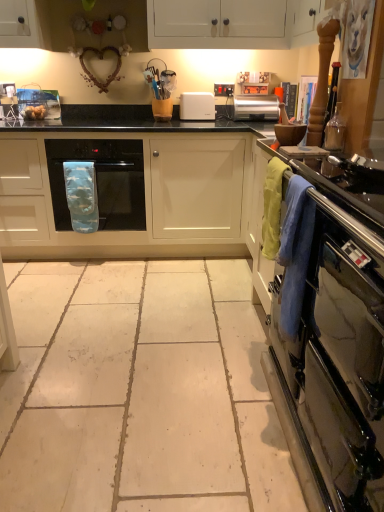
Question: Is blue fabric oven mitt at center in front of or behind black matte countertop at center in the image?

Choices:
 (A) behind
 (B) front

Answer: (A)

Question: Considering the positions of blue fabric oven mitt at center and black matte countertop at center in the image, is blue fabric oven mitt at center taller or shorter than black matte countertop at center?

Choices:
 (A) tall
 (B) short

Answer: (B)

Question: Which of these objects is positioned farthest from the stainless steel oven at right?

Choices:
 (A) white plastic toaster at center, the 2th appliance from the right
 (B) clear glass bottle at right, which is the first appliance in bottom-to-top order
 (C) silver metallic toaster at center
 (D) golden brown bread at left
 (E) soft cotton towel at right

Answer: (D)

Question: Based on their relative distances, which object is farther from the stainless steel oven at right?

Choices:
 (A) golden brown bread at left
 (B) white plastic toaster at center, the 2th appliance from the right
 (C) blue fabric oven mitt at center
 (D) soft cotton towel at right
 (E) silver metallic toaster at center

Answer: (A)